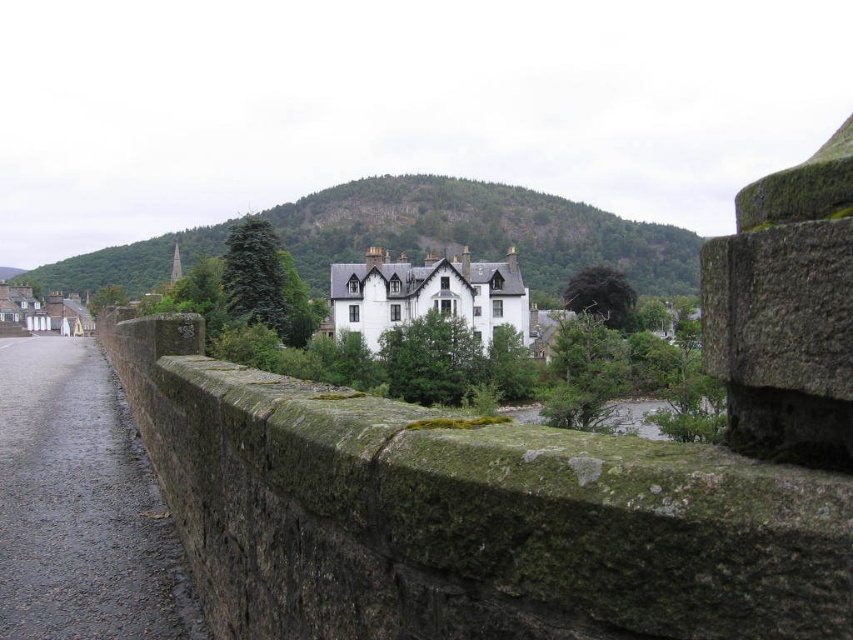
You are standing on the stone bridge and want to take a photo of the green mossy stone ledge at center and the white painted stone building at center. Which object appears larger in the photo?

The green mossy stone ledge at center appears larger in the photo because it is much taller than the white painted stone building at center.

You are standing on the stone bridge and want to take a photo of the white painted stone building at center. However, your camera has a limited field of view. Is the green mossy stone ledge at center blocking the view of the building?

The green mossy stone ledge at center is positioned under the white painted stone building at center, so it is blocking the view of the building.

You are standing on the stone bridge and see a point marked at coordinates (467,515). What object is located at that point?

The point at (467,515) corresponds to the green mossy stone ledge at center.